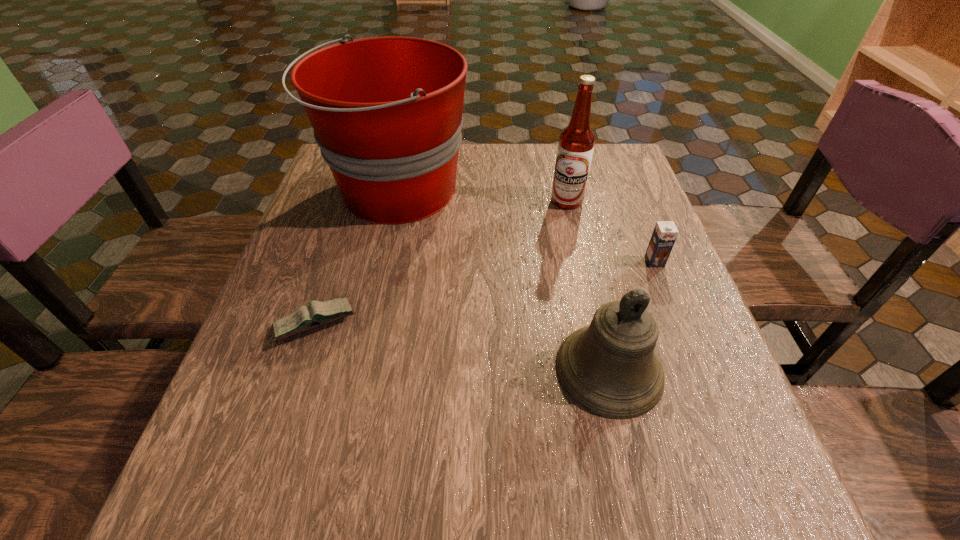
Where is `vacant area at the left edge of the desktop`? vacant area at the left edge of the desktop is located at coordinates (334, 258).

Locate an element on the screen. The width and height of the screenshot is (960, 540). free space at the right edge of the desktop is located at coordinates (658, 443).

Where is `free location at the far left corner of the desktop`? Image resolution: width=960 pixels, height=540 pixels. free location at the far left corner of the desktop is located at coordinates (322, 187).

This screenshot has width=960, height=540. Find the location of `vacant space at the far right corner`. vacant space at the far right corner is located at coordinates [597, 176].

This screenshot has height=540, width=960. Find the location of `vacant position at the near right corner of the desktop`. vacant position at the near right corner of the desktop is located at coordinates (671, 461).

Image resolution: width=960 pixels, height=540 pixels. I want to click on free area in between the fourth tallest object and the bucket, so click(x=525, y=227).

The width and height of the screenshot is (960, 540). Identify the location of empty location between the chocolate milk and the alcohol. (611, 231).

This screenshot has width=960, height=540. Identify the location of free spot between the alcohol and the shortest object. (442, 262).

Where is `blank region between the bucket and the alcohol`? This screenshot has height=540, width=960. blank region between the bucket and the alcohol is located at coordinates (481, 196).

This screenshot has height=540, width=960. Find the location of `free space between the bucket and the alcohol`. free space between the bucket and the alcohol is located at coordinates (481, 196).